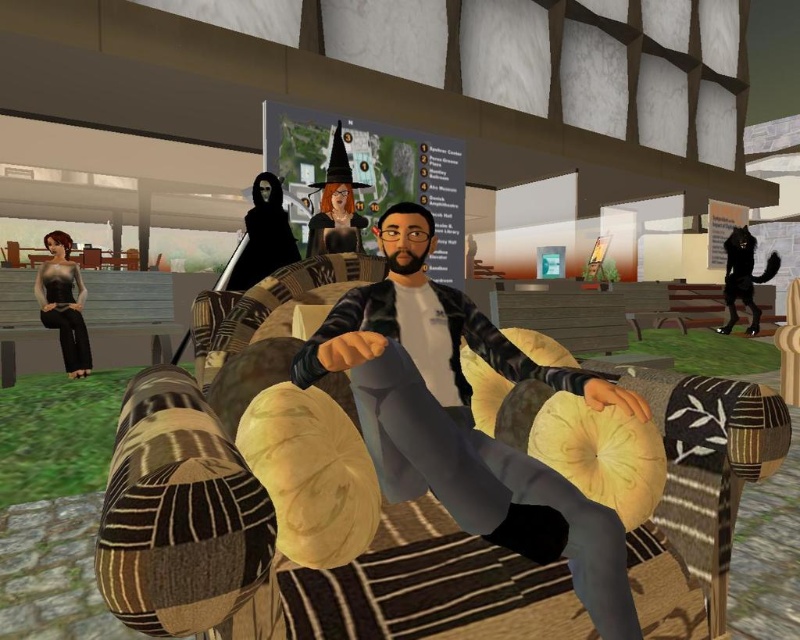
Question: Can you confirm if black matte figure at upper center is positioned to the right of black furry cat at upper right?

Choices:
 (A) no
 (B) yes

Answer: (A)

Question: Is matte gray sweater at center thinner than black furry cat at upper right?

Choices:
 (A) no
 (B) yes

Answer: (B)

Question: Which point is closer to the camera taking this photo?

Choices:
 (A) (260, 234)
 (B) (54, 310)
 (C) (512, 544)

Answer: (C)

Question: Considering the real-world distances, which object is closest to the black matte figure at upper center?

Choices:
 (A) matte gray sweater at center
 (B) matte black dress at left

Answer: (A)

Question: Is black matte figure at upper center behind black furry cat at upper right?

Choices:
 (A) no
 (B) yes

Answer: (A)

Question: Estimate the real-world distances between objects in this image. Which object is farther from the black matte figure at upper center?

Choices:
 (A) matte gray sweater at center
 (B) black furry cat at upper right
 (C) matte black dress at left

Answer: (B)